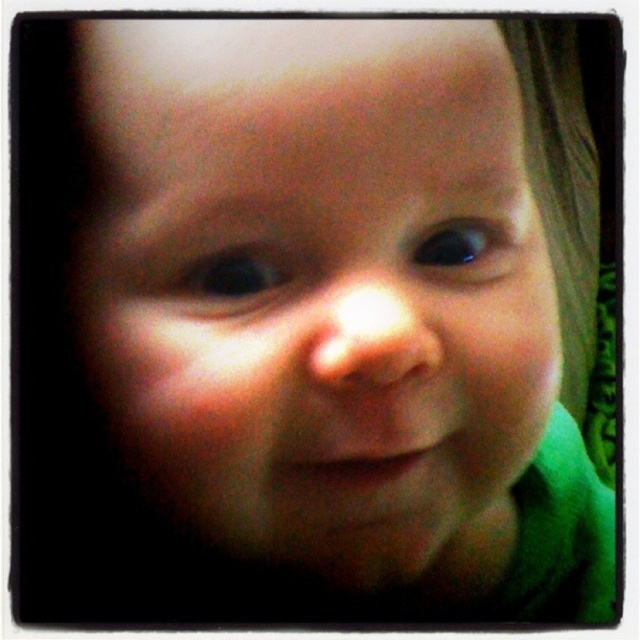
Does smooth skin baby at center lie in front of black glossy eye at center?

Yes, smooth skin baby at center is in front of black glossy eye at center.

Between point (128, 184) and point (442, 262), which one is positioned in front?

Point (128, 184) is more forward.

Does point (150, 112) come closer to viewer compared to point (442, 225)?

Yes, point (150, 112) is closer to viewer.

At what (x,y) coordinates should I click in order to perform the action: click on smooth skin baby at center. Please return your answer as a coordinate pair (x, y). This screenshot has width=640, height=640. Looking at the image, I should click on (317, 285).

Is smooth skin baby at center below blue glossy eye at center?

Correct, smooth skin baby at center is located below blue glossy eye at center.

Which is more to the right, smooth skin baby at center or blue glossy eye at center?

smooth skin baby at center is more to the right.

Locate an element on the screen. Image resolution: width=640 pixels, height=640 pixels. smooth skin baby at center is located at coordinates (317, 285).

I want to click on smooth skin baby at center, so click(317, 285).

Who is lower down, blue glossy eye at center or black glossy eye at center?

Positioned lower is blue glossy eye at center.

Does blue glossy eye at center have a greater height compared to black glossy eye at center?

No.

Between point (228, 253) and point (483, 232), which one is positioned in front?

Point (228, 253) is in front.

This screenshot has height=640, width=640. What are the coordinates of `blue glossy eye at center` in the screenshot? It's located at (232, 275).